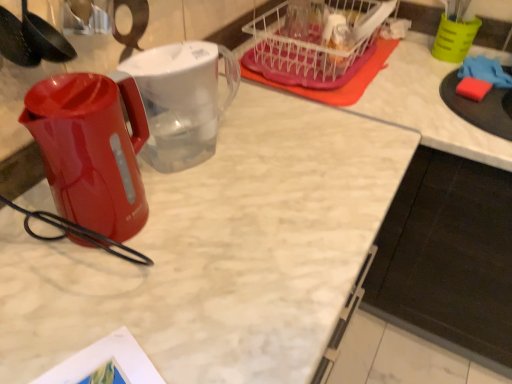
Find the location of a particular element. vacant area situated to the left side of green plastic cup at upper right is located at coordinates (407, 56).